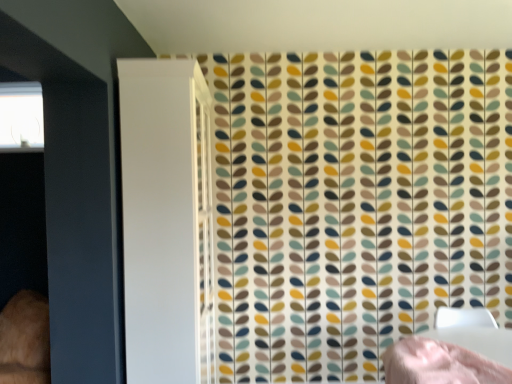
Question: Is transparent glass window at upper left wider than white glossy screen door at left?

Choices:
 (A) no
 (B) yes

Answer: (A)

Question: Is transparent glass window at upper left at the right side of white glossy screen door at left?

Choices:
 (A) yes
 (B) no

Answer: (B)

Question: From the image's perspective, does transparent glass window at upper left appear lower than white glossy screen door at left?

Choices:
 (A) yes
 (B) no

Answer: (B)

Question: Is white glossy screen door at left at the back of transparent glass window at upper left?

Choices:
 (A) no
 (B) yes

Answer: (A)

Question: Is transparent glass window at upper left bigger than white glossy screen door at left?

Choices:
 (A) yes
 (B) no

Answer: (B)

Question: From their relative heights in the image, would you say pink fabric bed at lower right is taller or shorter than white glossy screen door at left?

Choices:
 (A) tall
 (B) short

Answer: (B)

Question: From a real-world perspective, is pink fabric bed at lower right physically located above or below white glossy screen door at left?

Choices:
 (A) below
 (B) above

Answer: (A)

Question: In terms of width, does pink fabric bed at lower right look wider or thinner when compared to white glossy screen door at left?

Choices:
 (A) wide
 (B) thin

Answer: (A)

Question: Considering the relative positions of pink fabric bed at lower right and white glossy screen door at left in the image provided, is pink fabric bed at lower right to the left or to the right of white glossy screen door at left?

Choices:
 (A) right
 (B) left

Answer: (A)

Question: Based on their positions, is transparent glass window at upper left located to the left or right of white glossy screen door at left?

Choices:
 (A) right
 (B) left

Answer: (B)

Question: Considering the positions of point (18, 125) and point (205, 142), is point (18, 125) closer or farther from the camera than point (205, 142)?

Choices:
 (A) closer
 (B) farther

Answer: (B)

Question: In terms of size, does transparent glass window at upper left appear bigger or smaller than white glossy screen door at left?

Choices:
 (A) big
 (B) small

Answer: (B)

Question: Is transparent glass window at upper left inside or outside of white glossy screen door at left?

Choices:
 (A) outside
 (B) inside

Answer: (A)

Question: From the image's perspective, relative to transparent glass window at upper left, is white glossy screen door at left above or below?

Choices:
 (A) below
 (B) above

Answer: (A)

Question: Based on their sizes in the image, would you say white glossy screen door at left is bigger or smaller than transparent glass window at upper left?

Choices:
 (A) small
 (B) big

Answer: (B)